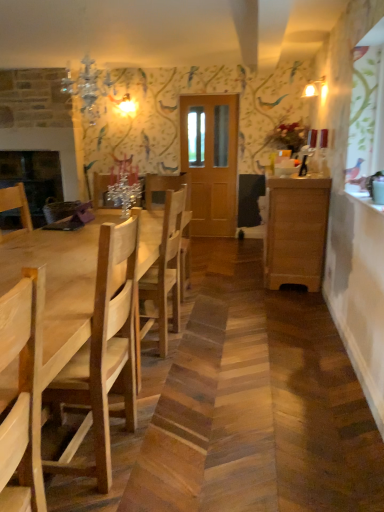
Question: Is natural wood chair at center, which is the second chair in front-to-back order, positioned behind wooden chair at left, placed as the 1th chair when sorted from front to back?

Choices:
 (A) yes
 (B) no

Answer: (A)

Question: Could you tell me if natural wood chair at center, which is the second chair in front-to-back order, is turned towards wooden chair at left, which appears as the 2th chair when viewed from the back?

Choices:
 (A) yes
 (B) no

Answer: (B)

Question: Is natural wood chair at center, which is the second chair in front-to-back order, taller than wooden chair at left, which appears as the 2th chair when viewed from the back?

Choices:
 (A) yes
 (B) no

Answer: (B)

Question: Is natural wood chair at center, the first chair positioned from the back, oriented away from wooden chair at left, which appears as the 2th chair when viewed from the back?

Choices:
 (A) yes
 (B) no

Answer: (B)

Question: From a real-world perspective, is natural wood chair at center, the first chair positioned from the back, physically above wooden chair at left, placed as the 1th chair when sorted from front to back?

Choices:
 (A) no
 (B) yes

Answer: (A)

Question: Can we say natural wood chair at center, the first chair positioned from the back, lies outside wooden chair at left, placed as the 1th chair when sorted from front to back?

Choices:
 (A) no
 (B) yes

Answer: (B)

Question: From the image's perspective, is wooden cabinet at right under light brown wooden table at left?

Choices:
 (A) no
 (B) yes

Answer: (A)

Question: Can you confirm if wooden cabinet at right is positioned to the right of light brown wooden table at left?

Choices:
 (A) no
 (B) yes

Answer: (B)

Question: Is wooden cabinet at right positioned far away from light brown wooden table at left?

Choices:
 (A) yes
 (B) no

Answer: (A)

Question: Can you confirm if wooden cabinet at right is wider than light brown wooden table at left?

Choices:
 (A) no
 (B) yes

Answer: (A)

Question: Is wooden cabinet at right in contact with light brown wooden table at left?

Choices:
 (A) no
 (B) yes

Answer: (A)

Question: From the image's perspective, is wooden cabinet at right above light brown wooden table at left?

Choices:
 (A) yes
 (B) no

Answer: (A)

Question: From a real-world perspective, does light brown wooden table at left sit lower than wooden cabinet at right?

Choices:
 (A) yes
 (B) no

Answer: (A)